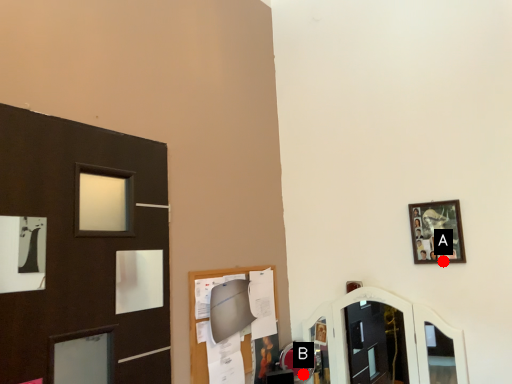
Question: Two points are circled on the image, labeled by A and B beside each circle. Which point is further to the camera?

Choices:
 (A) A is further
 (B) B is further

Answer: (B)